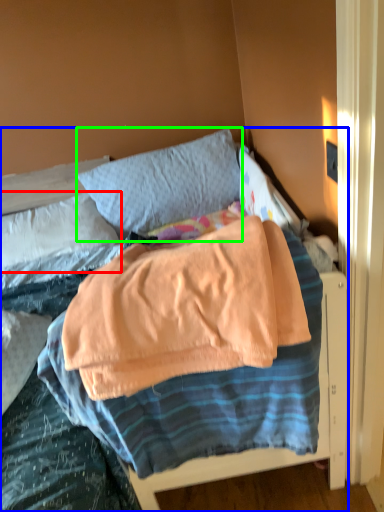
Question: Based on their relative distances, which object is farther from pillow (highlighted by a red box)? Choose from bed (highlighted by a blue box) and pillow (highlighted by a green box).

Choices:
 (A) bed
 (B) pillow

Answer: (B)